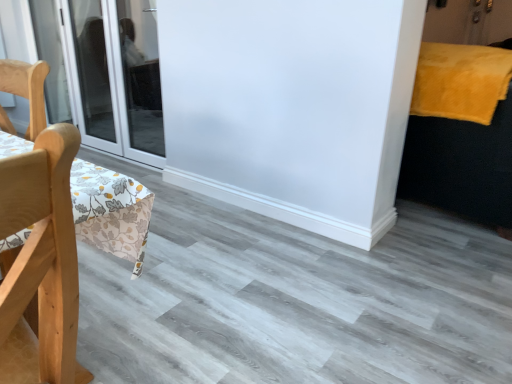
Question: Does yellow fluffy blanket at upper right appear on the right side of transparent glass door at left?

Choices:
 (A) no
 (B) yes

Answer: (B)

Question: From a real-world perspective, is yellow fluffy blanket at upper right beneath transparent glass door at left?

Choices:
 (A) yes
 (B) no

Answer: (B)

Question: Can you confirm if yellow fluffy blanket at upper right is thinner than transparent glass door at left?

Choices:
 (A) yes
 (B) no

Answer: (B)

Question: Would you consider yellow fluffy blanket at upper right to be distant from transparent glass door at left?

Choices:
 (A) no
 (B) yes

Answer: (B)

Question: Would you say yellow fluffy blanket at upper right contains transparent glass door at left?

Choices:
 (A) no
 (B) yes

Answer: (A)

Question: From the image's perspective, is yellow fluffy blanket at upper right on top of transparent glass door at left?

Choices:
 (A) yes
 (B) no

Answer: (B)

Question: Is velvet yellow bed at right wider than yellow fluffy blanket at upper right?

Choices:
 (A) yes
 (B) no

Answer: (A)

Question: Is velvet yellow bed at right bigger than yellow fluffy blanket at upper right?

Choices:
 (A) no
 (B) yes

Answer: (B)

Question: From the image's perspective, is velvet yellow bed at right located above yellow fluffy blanket at upper right?

Choices:
 (A) yes
 (B) no

Answer: (B)

Question: Is velvet yellow bed at right surrounding yellow fluffy blanket at upper right?

Choices:
 (A) yes
 (B) no

Answer: (A)

Question: Can you confirm if velvet yellow bed at right is smaller than yellow fluffy blanket at upper right?

Choices:
 (A) no
 (B) yes

Answer: (A)

Question: Does velvet yellow bed at right appear on the right side of yellow fluffy blanket at upper right?

Choices:
 (A) no
 (B) yes

Answer: (B)

Question: Can you confirm if velvet yellow bed at right is thinner than transparent glass door at left?

Choices:
 (A) yes
 (B) no

Answer: (B)